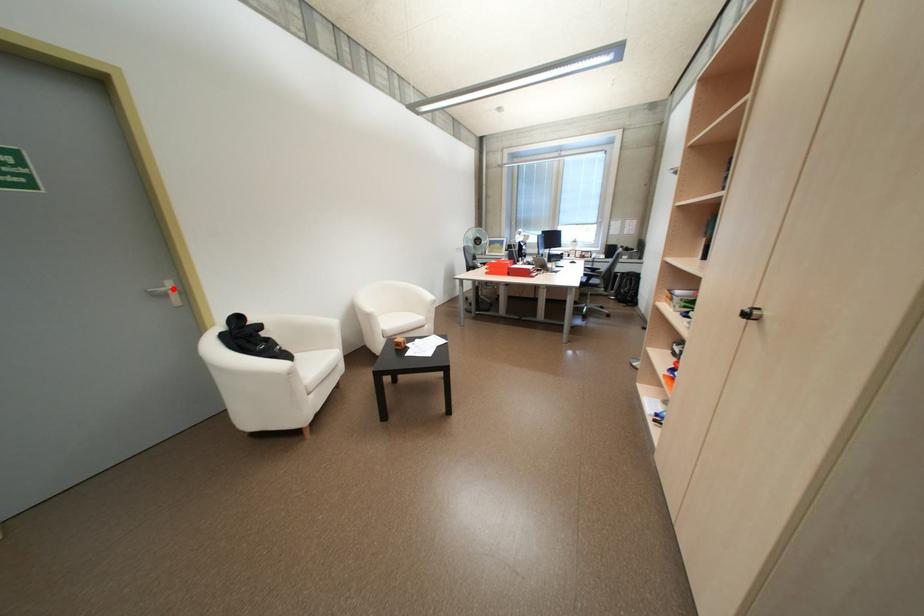
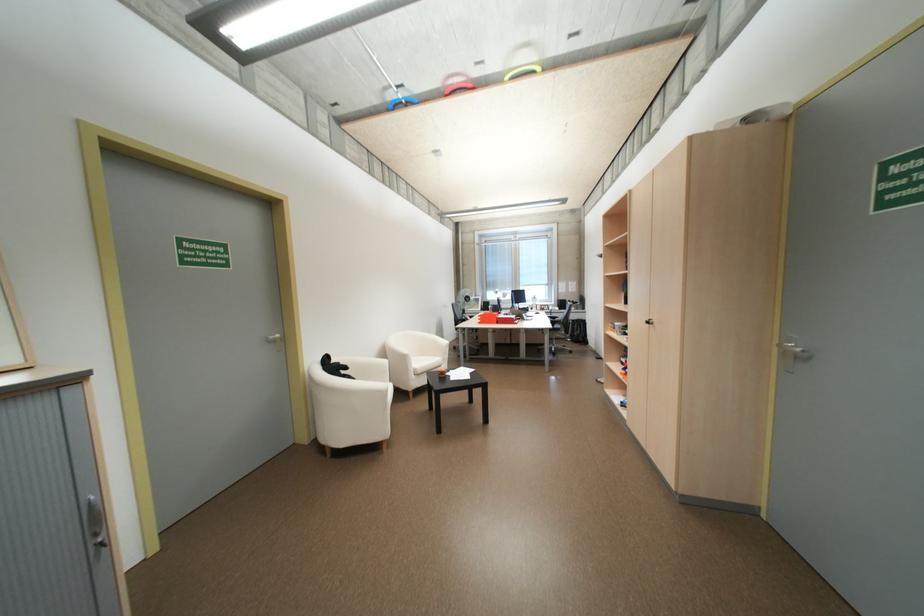
Question: I am providing you with two images of the same scene from different viewpoints. Given a red point in image1, look at the same physical point in image2. Is it:

Choices:
 (A) Closer to the viewpoint
 (B) Farther from the viewpoint

Answer: (A)